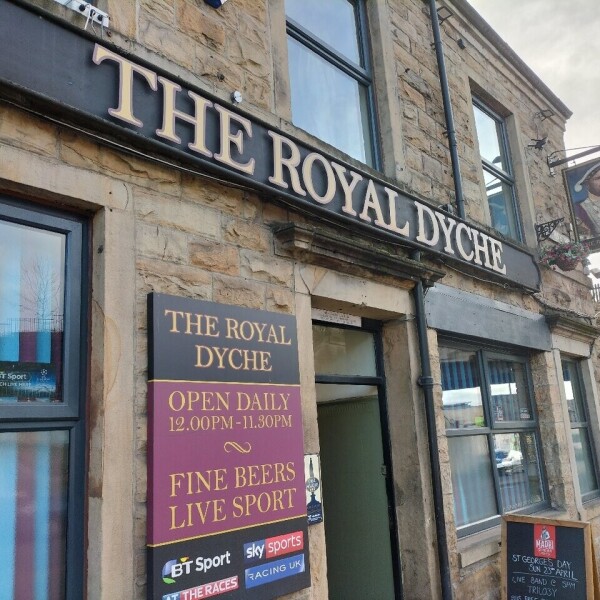
Where is `flower pot`? This screenshot has width=600, height=600. flower pot is located at coordinates (569, 263).